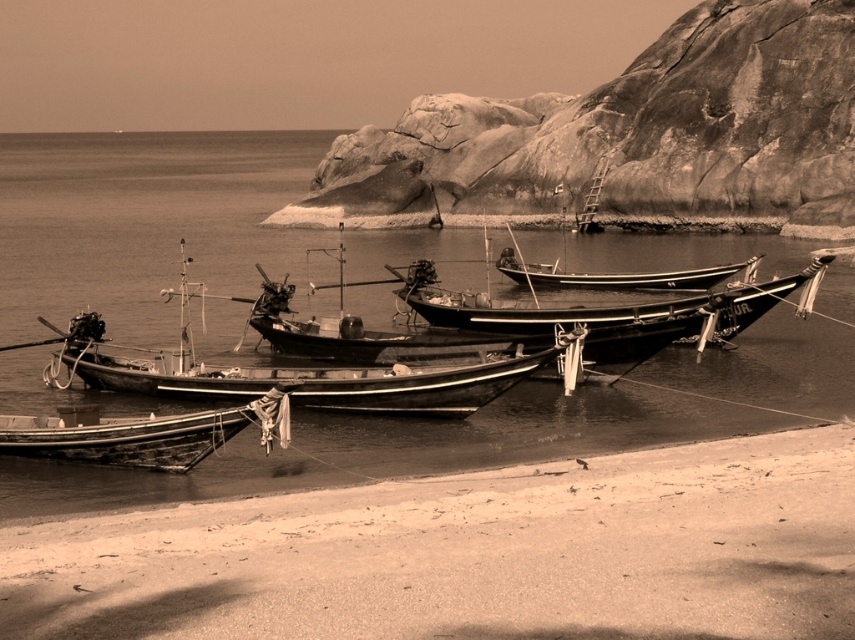
Does rugged stone cliff at upper center have a greater height compared to wooden boat at center?

Yes.

Is rugged stone cliff at upper center positioned in front of wooden boat at center?

No, rugged stone cliff at upper center is further to the viewer.

Does point (809, 204) come farther from viewer compared to point (196, 365)?

Yes, it is behind point (196, 365).

Where is `rugged stone cliff at upper center`? The width and height of the screenshot is (855, 640). rugged stone cliff at upper center is located at coordinates (631, 138).

Is wooden boat at center to the right of wooden boat at lower left from the viewer's perspective?

No, wooden boat at center is not to the right of wooden boat at lower left.

Image resolution: width=855 pixels, height=640 pixels. What are the coordinates of `wooden boat at center` in the screenshot? It's located at (293, 374).

Can you confirm if sepia water at center is positioned to the left of wooden boat at lower left?

Correct, you'll find sepia water at center to the left of wooden boat at lower left.

Who is lower down, sepia water at center or wooden boat at lower left?

Positioned lower is wooden boat at lower left.

Does point (499, 444) lie behind point (140, 460)?

Yes, it is behind point (140, 460).

The image size is (855, 640). I want to click on sepia water at center, so click(x=494, y=426).